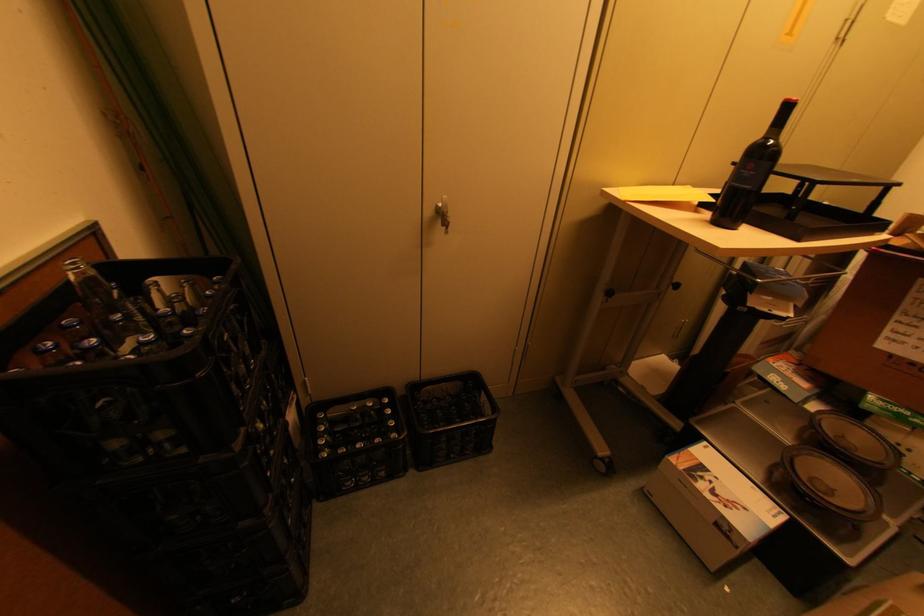
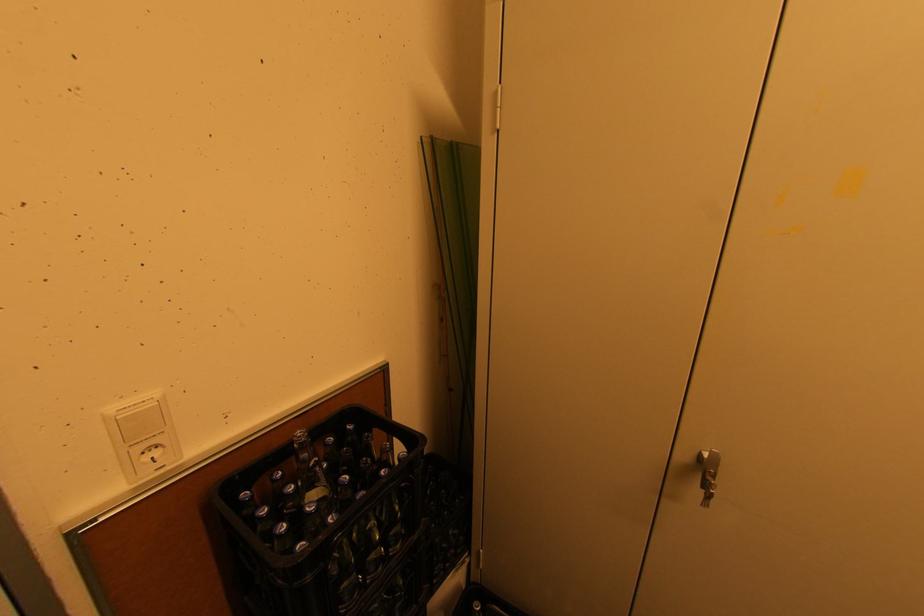
Question: The images are taken continuously from a first-person perspective. In which direction is your viewpoint rotating?

Choices:
 (A) Left
 (B) Right
 (C) Up
 (D) Down

Answer: (A)